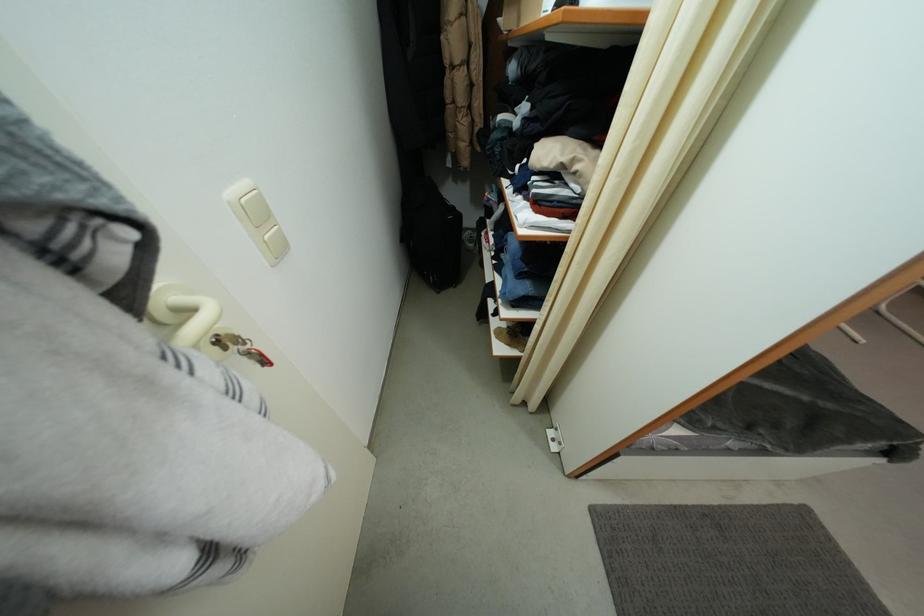
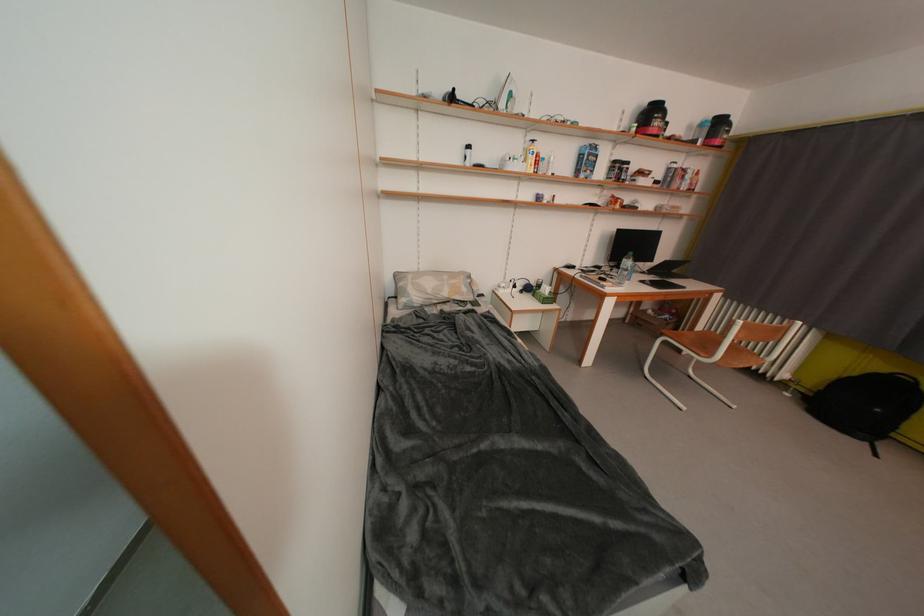
Question: How did the camera likely rotate?

Choices:
 (A) Left
 (B) Right
 (C) Up
 (D) Down

Answer: (C)